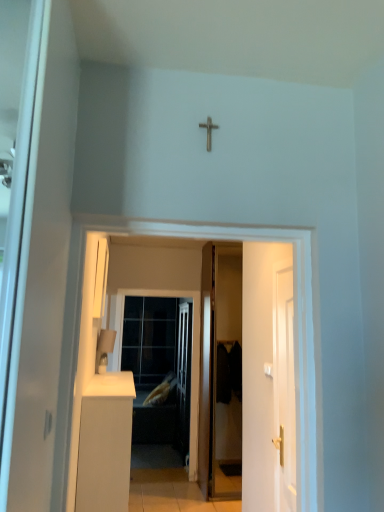
Question: Is metallic cross at upper center outside white glossy door at right, arranged as the second door when viewed from the left?

Choices:
 (A) no
 (B) yes

Answer: (B)

Question: Can you confirm if metallic cross at upper center is thinner than white glossy door at right, arranged as the second door when viewed from the left?

Choices:
 (A) no
 (B) yes

Answer: (A)

Question: Does metallic cross at upper center have a greater height compared to white glossy door at right, arranged as the second door when viewed from the left?

Choices:
 (A) yes
 (B) no

Answer: (B)

Question: From the image's perspective, is metallic cross at upper center on top of white glossy door at right, the second door positioned from the back?

Choices:
 (A) no
 (B) yes

Answer: (B)

Question: Can you confirm if metallic cross at upper center is bigger than white glossy door at right, the first door in the front-to-back sequence?

Choices:
 (A) no
 (B) yes

Answer: (A)

Question: In terms of height, does white matte cabinet at lower left look taller or shorter compared to soft yellow fabric pillow at center?

Choices:
 (A) short
 (B) tall

Answer: (B)

Question: Is white matte cabinet at lower left bigger or smaller than soft yellow fabric pillow at center?

Choices:
 (A) big
 (B) small

Answer: (A)

Question: From a real-world perspective, is white matte cabinet at lower left above or below soft yellow fabric pillow at center?

Choices:
 (A) below
 (B) above

Answer: (B)

Question: Is white matte cabinet at lower left in front of or behind soft yellow fabric pillow at center in the image?

Choices:
 (A) front
 (B) behind

Answer: (A)

Question: Is white matte cabinet at lower left situated inside white glossy door at right, the second door positioned from the back, or outside?

Choices:
 (A) outside
 (B) inside

Answer: (A)

Question: Is point (107, 495) closer or farther from the camera than point (288, 394)?

Choices:
 (A) farther
 (B) closer

Answer: (B)

Question: Considering the positions of white matte cabinet at lower left and white glossy door at right, arranged as the second door when viewed from the left, in the image, is white matte cabinet at lower left bigger or smaller than white glossy door at right, arranged as the second door when viewed from the left,?

Choices:
 (A) small
 (B) big

Answer: (B)

Question: Looking at their shapes, would you say white matte cabinet at lower left is wider or thinner than white glossy door at right, which ranks as the first door in right-to-left order?

Choices:
 (A) thin
 (B) wide

Answer: (B)

Question: Is white matte cabinet at lower left inside or outside of white glossy door at center?

Choices:
 (A) inside
 (B) outside

Answer: (B)

Question: Considering the positions of point (102, 377) and point (221, 234), is point (102, 377) closer or farther from the camera than point (221, 234)?

Choices:
 (A) closer
 (B) farther

Answer: (B)